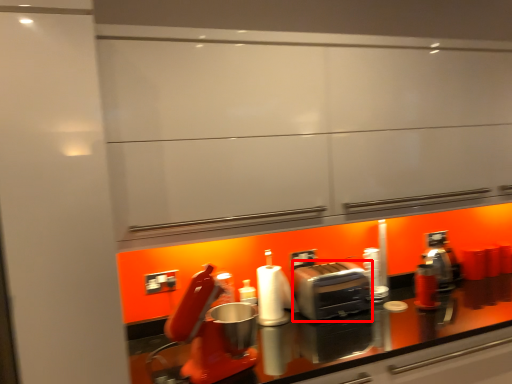
Question: Where is toaster (annotated by the red box) located in relation to paper towel in the image?

Choices:
 (A) right
 (B) left

Answer: (A)